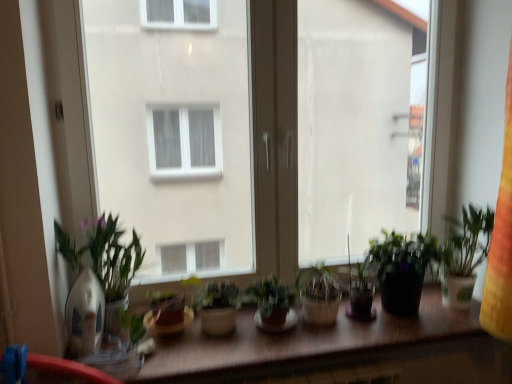
Question: Is transparent plastic window screen at center, which is the 1th window screen in right-to-left order, to the left or to the right of matte brown pot at center, which is the 1th houseplant from left to right, in the image?

Choices:
 (A) left
 (B) right

Answer: (B)

Question: From a real-world perspective, is transparent plastic window screen at center, acting as the 2th window screen starting from the left, physically located above or below matte brown pot at center, which is the 1th houseplant from left to right?

Choices:
 (A) above
 (B) below

Answer: (A)

Question: Estimate the real-world distances between objects in this image. Which object is closer to the transparent glass window at center?

Choices:
 (A) white matte window screen at center, arranged as the 2th window screen when viewed from the right
 (B) wooden table at center
 (C) green matte plant at center, which is the 2th houseplant from right to left
 (D) matte brown pot at center, which appears as the fourth houseplant when viewed from the right
 (E) translucent plastic pot at center, acting as the 4th houseplant starting from the left

Answer: (C)

Question: Which of these objects is positioned closest to the transparent glass window at center?

Choices:
 (A) green matte plant at center, positioned as the 2th houseplant in left-to-right order
 (B) matte brown pot at center, which appears as the fourth houseplant when viewed from the right
 (C) white matte window screen at center, which is the 1th window screen in left-to-right order
 (D) wooden table at center
 (E) green matte plant at center, which is counted as the 3th houseplant, starting from the left

Answer: (E)